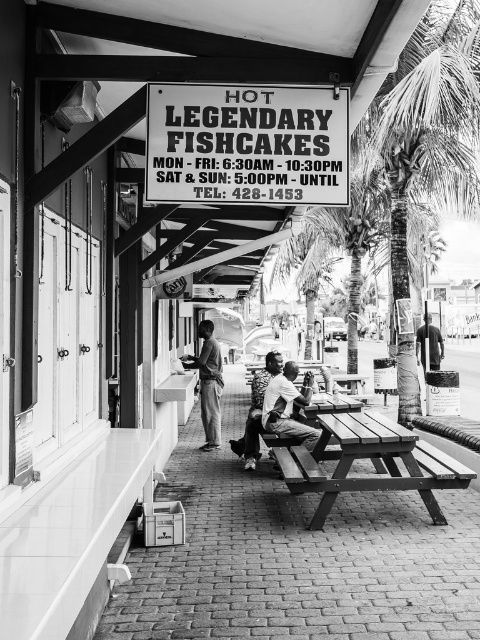
Is dark skin textured shirt at center to the right of light skin tone shirt at center from the viewer's perspective?

Correct, you'll find dark skin textured shirt at center to the right of light skin tone shirt at center.

In order to click on dark skin textured shirt at center in this screenshot , I will do `click(288, 404)`.

Which is below, coarse textured palm tree at right or light skin tone shirt at center?

Positioned lower is light skin tone shirt at center.

Where is `coarse textured palm tree at right`? The image size is (480, 640). coarse textured palm tree at right is located at coordinates (422, 138).

Find the location of a particular element. Image resolution: width=480 pixels, height=640 pixels. coarse textured palm tree at right is located at coordinates (422, 138).

Does white paper sign at upper center have a larger size compared to coarse textured palm tree at right?

Yes.

How far apart are white paper sign at upper center and coarse textured palm tree at right?

white paper sign at upper center and coarse textured palm tree at right are 8.80 meters apart from each other.

Between point (245, 136) and point (464, 170), which one is positioned behind?

Point (464, 170)

I want to click on white paper sign at upper center, so click(x=247, y=145).